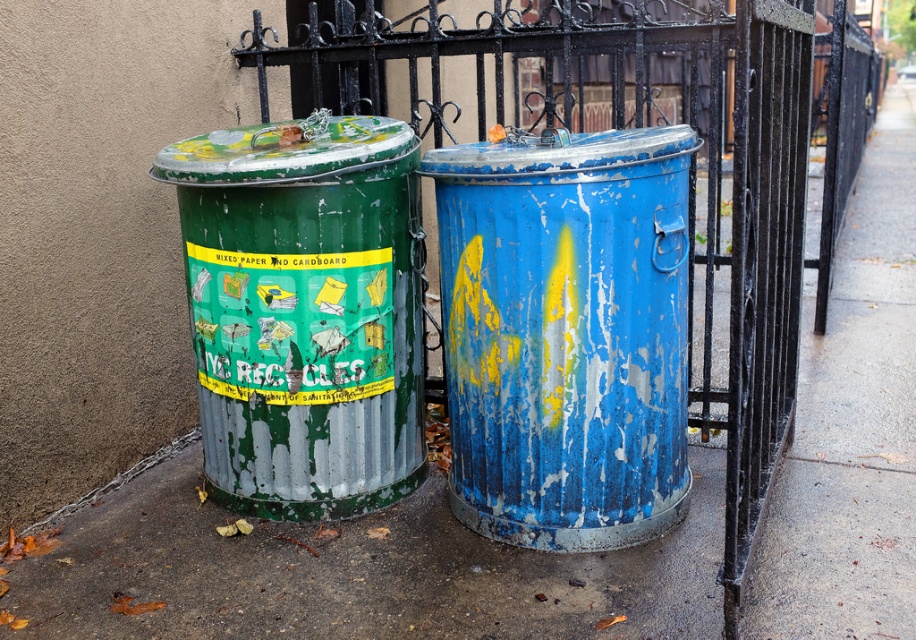
Question: Which of the following is the closest to the observer?

Choices:
 (A) (424, 97)
 (B) (377, 301)
 (C) (454, 506)

Answer: (B)

Question: Estimate the real-world distances between objects in this image. Which object is closer to the green corrugated metal recycling bin at left?

Choices:
 (A) brushed metal fence at center
 (B) rusty metal trash can at center

Answer: (B)

Question: Is brushed metal fence at center closer to the viewer compared to green corrugated metal recycling bin at left?

Choices:
 (A) no
 (B) yes

Answer: (A)

Question: Can you confirm if brushed metal fence at center is wider than green corrugated metal recycling bin at left?

Choices:
 (A) no
 (B) yes

Answer: (A)

Question: Which point is farther to the camera?

Choices:
 (A) rusty metal trash can at center
 (B) green corrugated metal recycling bin at left
 (C) brushed metal fence at center

Answer: (C)

Question: Is the position of rusty metal trash can at center more distant than that of green corrugated metal recycling bin at left?

Choices:
 (A) no
 (B) yes

Answer: (A)